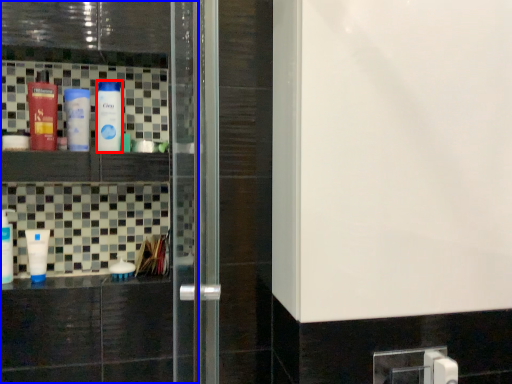
Question: Which point is further to the camera, bottle (highlighted by a red box) or screen door (highlighted by a blue box)?

Choices:
 (A) bottle
 (B) screen door

Answer: (A)